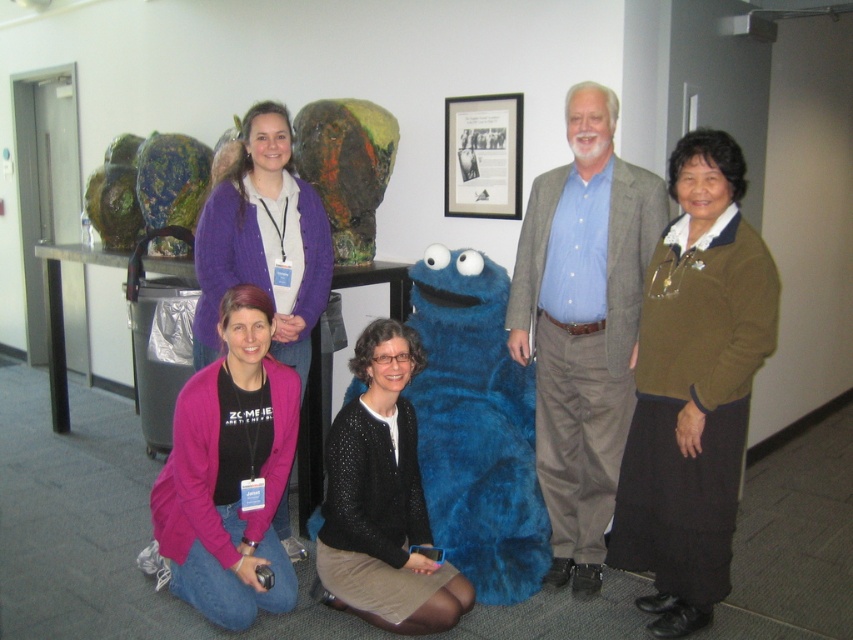
Question: Is pink fleece jacket at lower left wider than black knitted sweater at center?

Choices:
 (A) yes
 (B) no

Answer: (A)

Question: Which point is farther from the camera taking this photo?

Choices:
 (A) (358, 596)
 (B) (569, 532)
 (C) (196, 243)

Answer: (B)

Question: Which object is farther from the camera taking this photo?

Choices:
 (A) gray wool suit at center
 (B) purple sweater at upper left

Answer: (A)

Question: Which object appears farthest from the camera in this image?

Choices:
 (A) green sweater at right
 (B) purple sweater at upper left

Answer: (B)

Question: Does green sweater at right lie in front of black knitted sweater at center?

Choices:
 (A) yes
 (B) no

Answer: (A)

Question: Does green sweater at right come behind black knitted sweater at center?

Choices:
 (A) no
 (B) yes

Answer: (A)